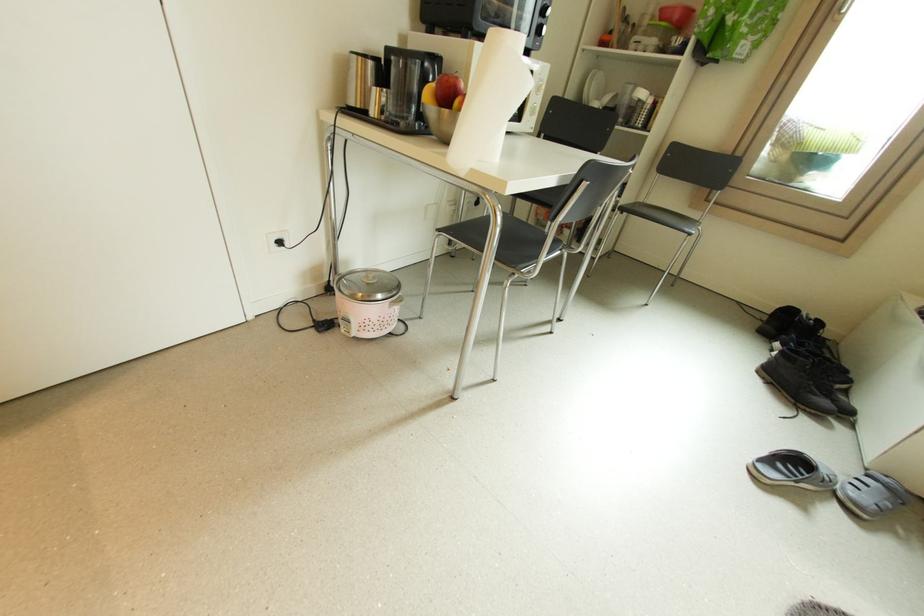
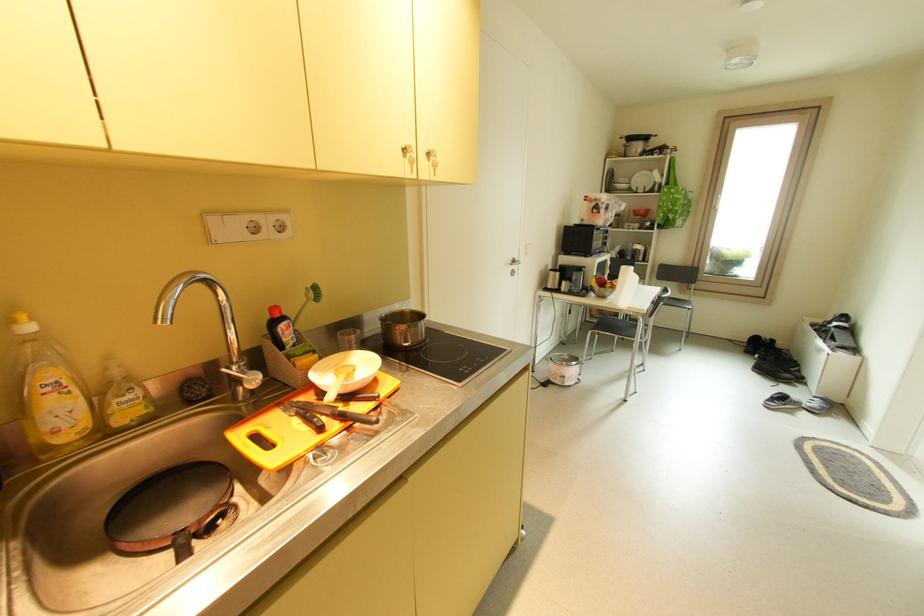
Where in the second image is the point corresponding to pixel 373 328 from the first image?

(578, 379)